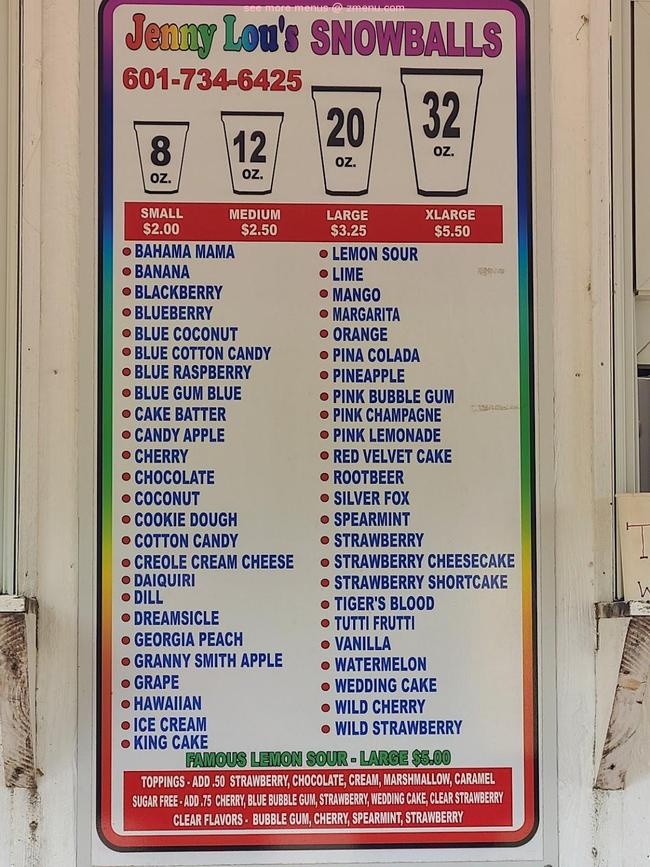
Where is `cup base`? The image size is (650, 867). cup base is located at coordinates (168, 190), (247, 190), (344, 190), (446, 187).